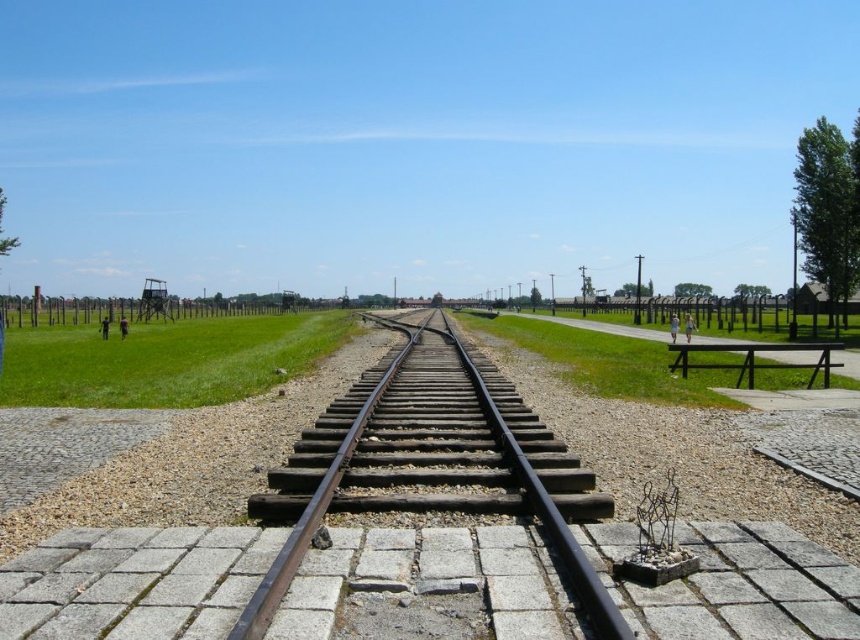
You are a photographer planning to take a picture of the green grass at center and the black metal train track at center. Based on their heights, which object should you focus on first if you want both to be in sharp focus?

The green grass at center is shorter than the black metal train track at center, so you should focus on the black metal train track at center first to ensure both are in sharp focus.

You are a photographer planning to capture the entire railway scene in one shot. Given that your camera can only focus on objects within a 10m width, and you want to include both the green grass at center and the black metal train track at center, will the width of these two objects combined fit within your camera frame?

The green grass at center is bigger than the black metal train track at center. However, without specific measurements of their individual widths, it is impossible to determine if their combined width falls within the 10m limit. Additional information about their exact dimensions is needed to answer this accurately.

You are a tourist standing at the entrance of the memorial site. You want to walk to the green grass at center. According to the image, where should you head towards?

The green grass at center is located at point 0.841 on the x axis and 0.493 on the y axis, so you should head towards that coordinate to reach it.